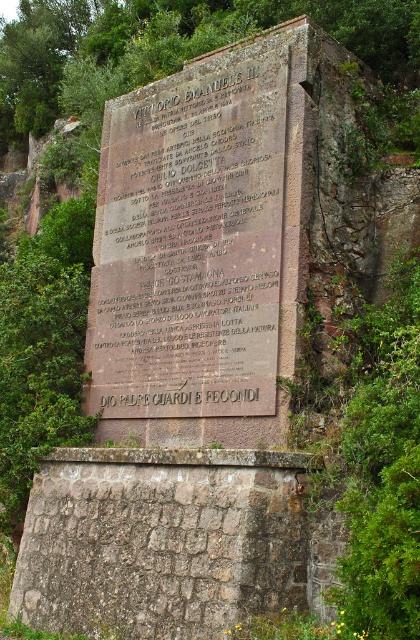
Question: Which object is farther from the camera taking this photo?

Choices:
 (A) dark brown stone plaque at center
 (B) rusty stone wall at center

Answer: (A)

Question: Among these objects, which one is farthest from the camera?

Choices:
 (A) rusty stone wall at center
 (B) dark brown stone plaque at center

Answer: (B)

Question: Does dark brown stone plaque at center appear on the right side of rusty stone wall at center?

Choices:
 (A) yes
 (B) no

Answer: (A)

Question: Can you confirm if dark brown stone plaque at center is bigger than rusty stone wall at center?

Choices:
 (A) yes
 (B) no

Answer: (A)

Question: Can you confirm if dark brown stone plaque at center is positioned to the right of rusty stone wall at center?

Choices:
 (A) no
 (B) yes

Answer: (B)

Question: Among these objects, which one is nearest to the camera?

Choices:
 (A) dark brown stone plaque at center
 (B) rusty stone wall at center

Answer: (B)